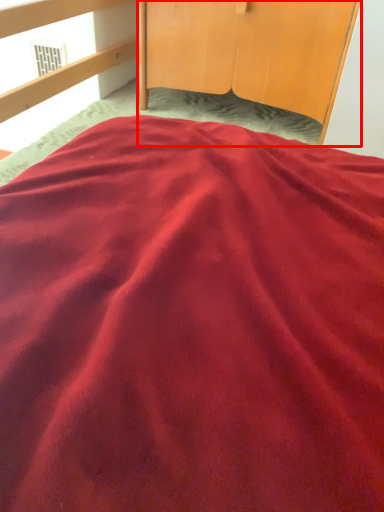
Question: From the image's perspective, where is furniture (annotated by the red box) located in relation to window in the image?

Choices:
 (A) above
 (B) below

Answer: (B)